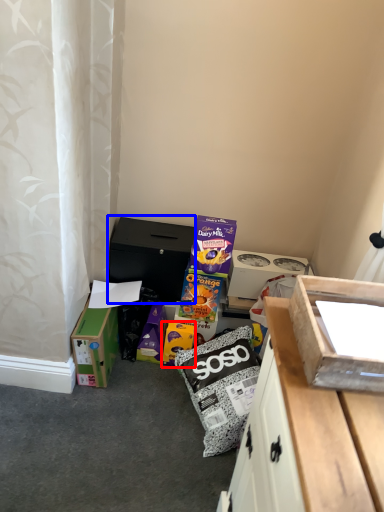
Question: Which object appears farthest to the camera in this image, cardboard box (highlighted by a red box) or cardboard box (highlighted by a blue box)?

Choices:
 (A) cardboard box
 (B) cardboard box

Answer: (B)